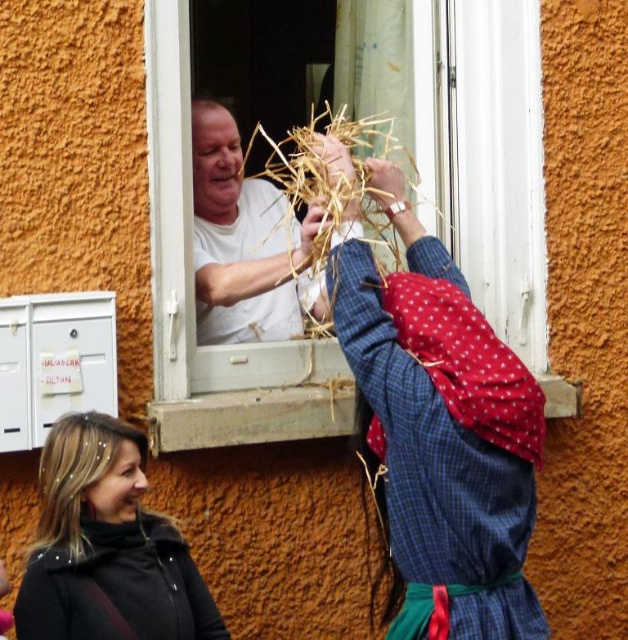
Question: Is black leather jacket at lower left to the right of white matte shirt at upper center from the viewer's perspective?

Choices:
 (A) no
 (B) yes

Answer: (A)

Question: Observing the image, what is the correct spatial positioning of white plastic window at center in reference to white matte shirt at upper center?

Choices:
 (A) left
 (B) right

Answer: (B)

Question: Which object is positioned closest to the black leather jacket at lower left?

Choices:
 (A) white plastic window at center
 (B) white matte shirt at upper center

Answer: (B)

Question: Among these points, which one is farthest from the camera?

Choices:
 (A) click(x=224, y=312)
 (B) click(x=90, y=561)
 (C) click(x=428, y=24)

Answer: (C)

Question: Estimate the real-world distances between objects in this image. Which object is closer to the white matte shirt at upper center?

Choices:
 (A) black leather jacket at lower left
 (B) white plastic window at center

Answer: (B)

Question: Is white plastic window at center further to the viewer compared to black leather jacket at lower left?

Choices:
 (A) no
 (B) yes

Answer: (B)